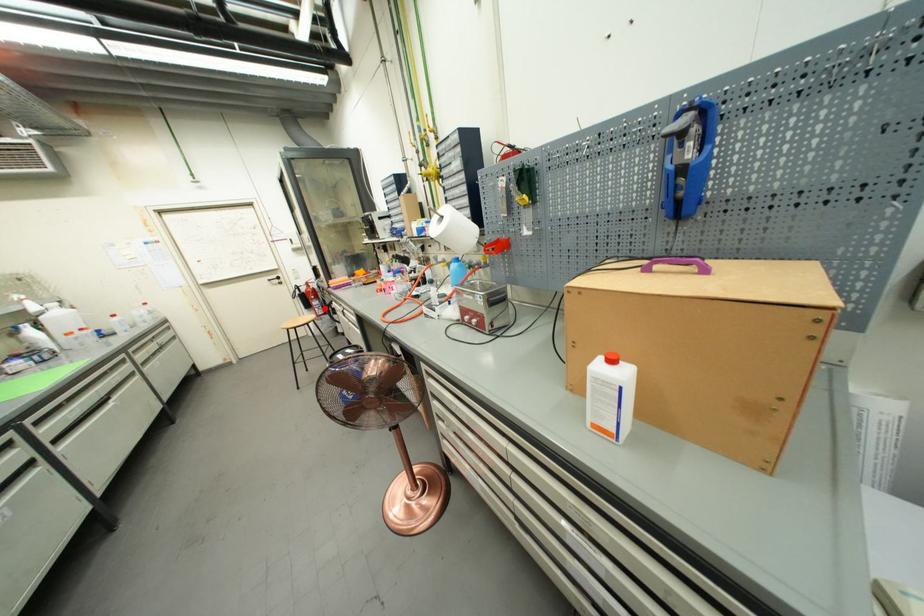
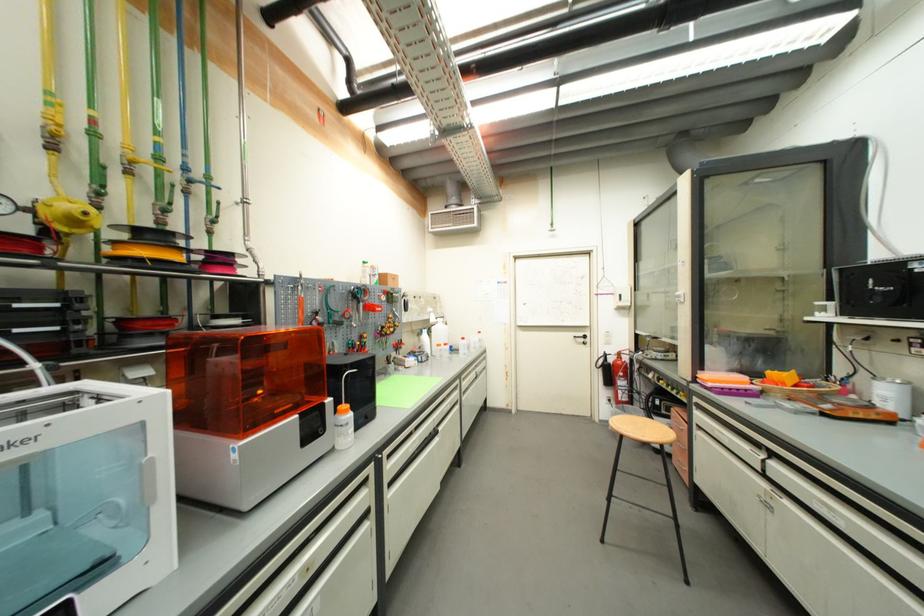
In the second image, find the point that corresponds to the highlighted location in the first image.

(630, 391)